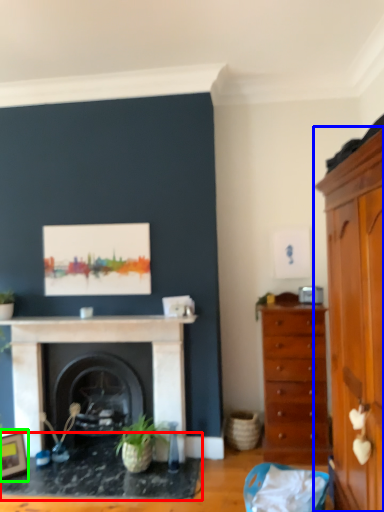
Question: Based on their relative distances, which object is farther from table (highlighted by a red box)? Choose from cabinetry (highlighted by a blue box) and picture frame (highlighted by a green box).

Choices:
 (A) cabinetry
 (B) picture frame

Answer: (A)